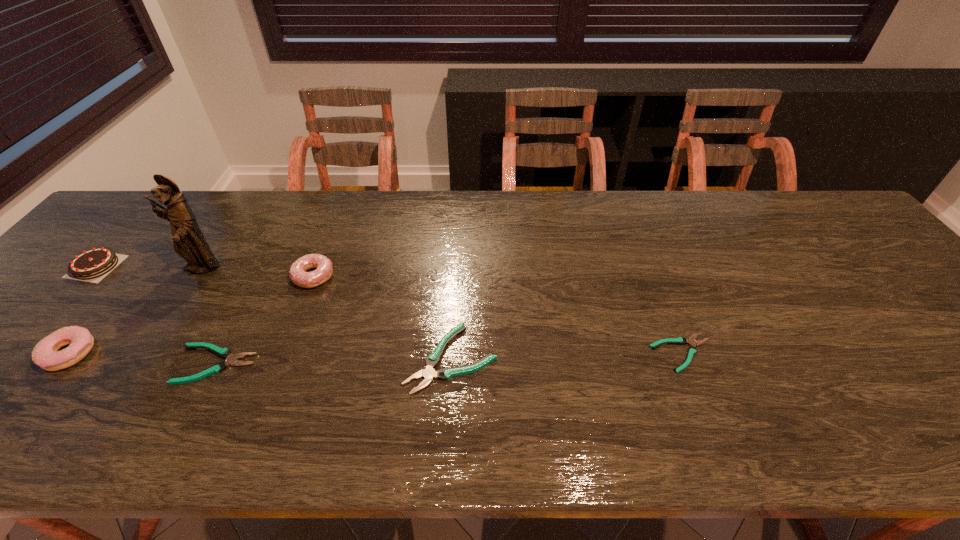
Where is `vacant region between the left doughnut and the shortest pliers`? The image size is (960, 540). vacant region between the left doughnut and the shortest pliers is located at coordinates (375, 353).

Where is `free area in between the tallest object and the nearer doughnut`? The image size is (960, 540). free area in between the tallest object and the nearer doughnut is located at coordinates (135, 311).

Where is `vacant area that lies between the left doughnut and the second pliers from right to left`? This screenshot has height=540, width=960. vacant area that lies between the left doughnut and the second pliers from right to left is located at coordinates (260, 356).

Image resolution: width=960 pixels, height=540 pixels. Identify the location of free spot between the nearer doughnut and the second pliers from right to left. (260, 356).

Locate an element on the screen. The image size is (960, 540). free point between the nearer doughnut and the chocolate cake is located at coordinates (83, 310).

Where is `free point between the second pliers from left to right and the chocolate cake`? free point between the second pliers from left to right and the chocolate cake is located at coordinates (274, 313).

Identify which object is located as the second nearest to the second tallest pliers. Please provide its 2D coordinates. Your answer should be formatted as a tuple, i.e. [(x, y)], where the tuple contains the x and y coordinates of a point satisfying the conditions above.

[(189, 242)]

Image resolution: width=960 pixels, height=540 pixels. Identify the location of object that stands as the closest to the left doughnut. (96, 262).

Find the location of a particular element. the second closest pliers to the shortest pliers is located at coordinates (225, 353).

Identify which pliers is the third nearest to the tallest object. Please provide its 2D coordinates. Your answer should be formatted as a tuple, i.e. [(x, y)], where the tuple contains the x and y coordinates of a point satisfying the conditions above.

[(692, 350)]